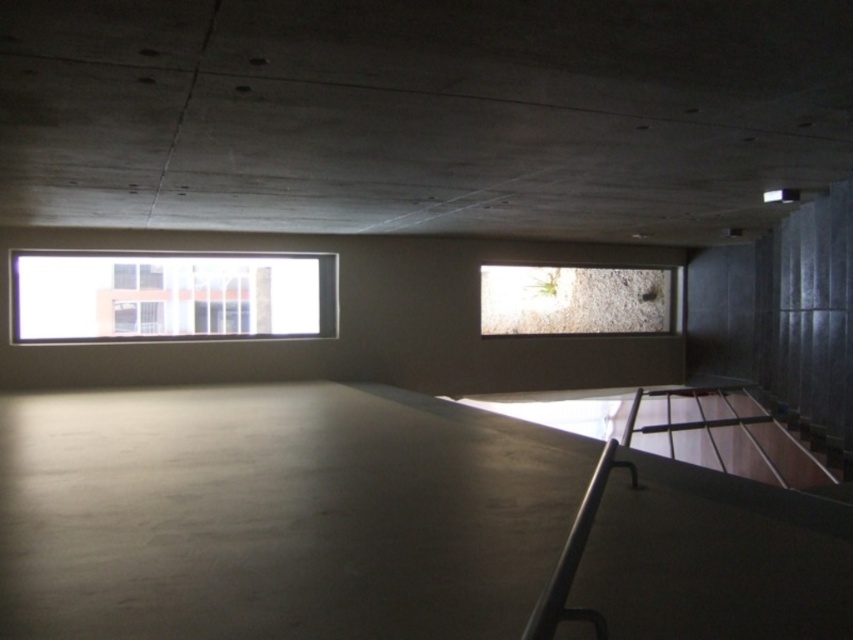
You are standing in the room and want to look outside through the clear glass window at center. Which direction should you move to reach it from the smooth concrete floor at center?

The smooth concrete floor at center is below the clear glass window at center, so you should move upward to reach the clear glass window at center.